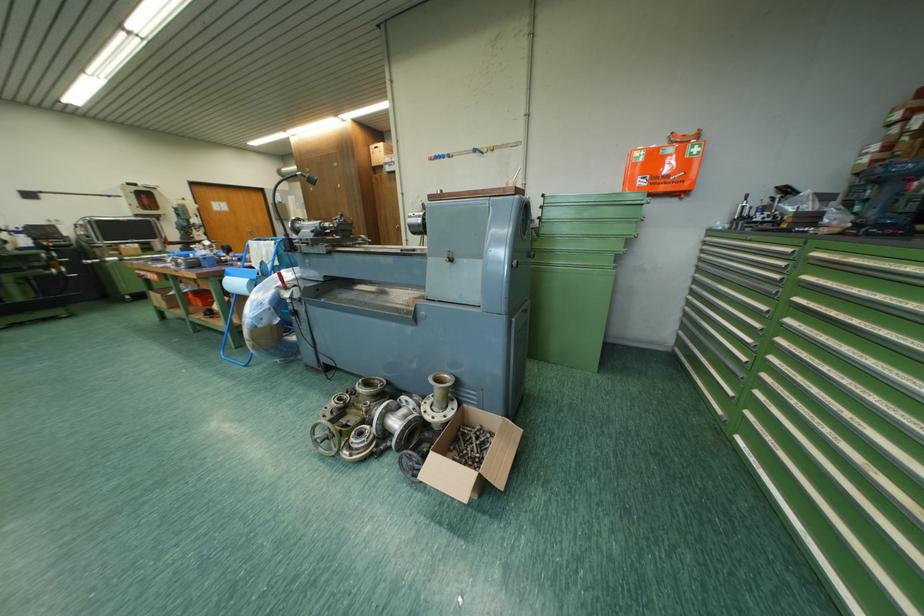
Find the location of a particular element. The width and height of the screenshot is (924, 616). lathe handwheel is located at coordinates (324, 437).